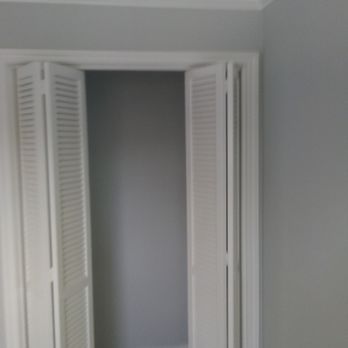
Locate an element on the screen. wall (above closet) is located at coordinates (193, 26).